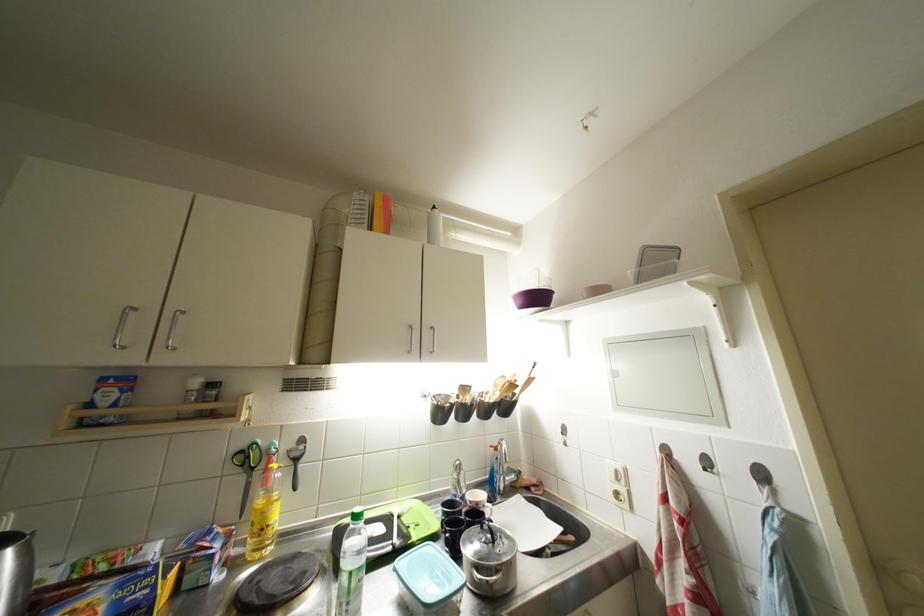
The width and height of the screenshot is (924, 616). What do you see at coordinates (429, 581) in the screenshot?
I see `the light blue container lid` at bounding box center [429, 581].